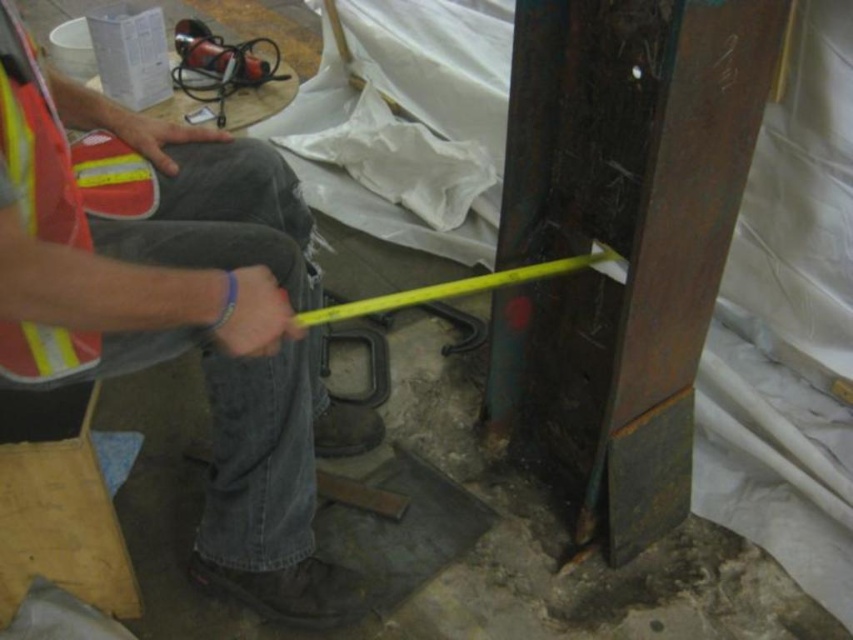
Question: Can you confirm if denim jeans at center is bigger than reflective fabric safety vest at left?

Choices:
 (A) yes
 (B) no

Answer: (A)

Question: Does denim jeans at center appear on the left side of reflective fabric safety vest at left?

Choices:
 (A) yes
 (B) no

Answer: (B)

Question: Which point is farther from the camera taking this photo?

Choices:
 (A) (4, 134)
 (B) (49, 356)

Answer: (B)

Question: Which object is closer to the camera taking this photo?

Choices:
 (A) reflective fabric safety vest at left
 (B) denim jeans at center

Answer: (B)

Question: Can you confirm if denim jeans at center is thinner than reflective fabric safety vest at left?

Choices:
 (A) yes
 (B) no

Answer: (B)